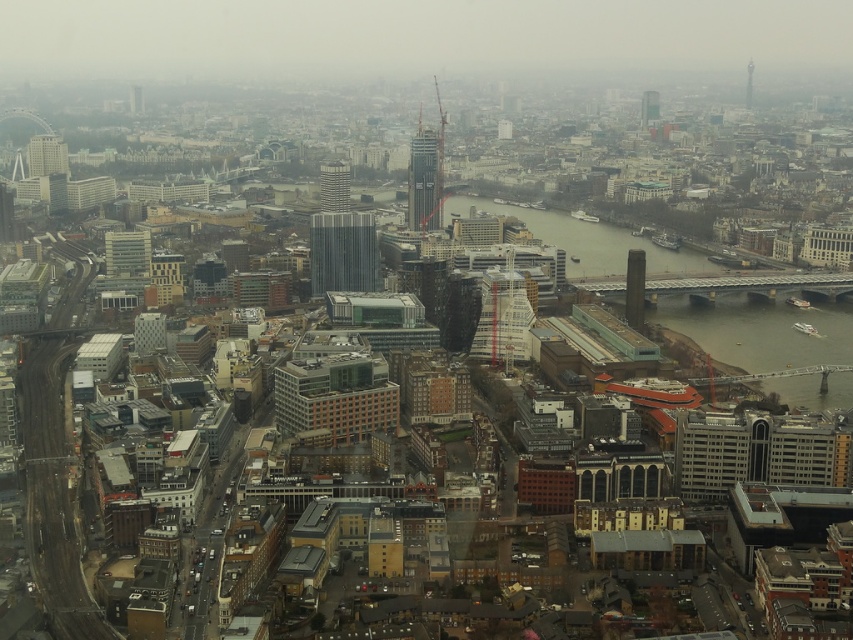
You are a city planner analyzing the skyline of this urban area. Which of the two skyscrapers, the metallic glass skyscraper at center or the glassy modern skyscraper at upper right, has a greater height?

The metallic glass skyscraper at center is much taller than the glassy modern skyscraper at upper right, so it has a greater height.

You are a drone operator flying a drone over the city. You need to determine which of the two points, point (x=419, y=154) or point (x=647, y=120), is closer to your current position. Based on the image, which point is closer?

Point (x=419, y=154) is closer to the camera than point (x=647, y=120), so the point closer to your current position is point (x=419, y=154).

You are a drone operator who needs to fly a drone from the metallic glass skyscraper at center to the glassy modern skyscraper at upper right. Which direction should you fly the drone to reach the destination?

The metallic glass skyscraper at center is to the left of the glassy modern skyscraper at upper right, so you should fly the drone to the right to reach the destination.